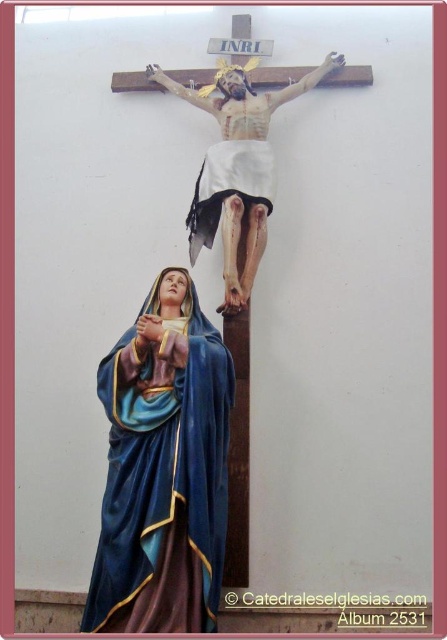
Based on the scene description and the coordinates provided, what object is located at the coordinates point (163, 468)?

The object at point (163, 468) is the matte blue fabric statue at lower left.

Based on the scene described, which object is larger in size between the matte blue fabric statue at lower left and the wooden crucifix at upper center?

The wooden crucifix at upper center is larger in size compared to the matte blue fabric statue at lower left.

You are an art student analyzing the composition of the religious scene. You notice the matte blue fabric statue at lower left and the wooden crucifix at upper center. Based on their positions, which object is placed higher in the image?

The wooden crucifix at upper center is placed higher in the image than the matte blue fabric statue at lower left.